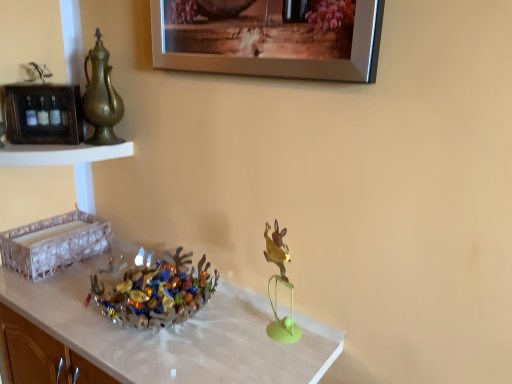
Question: Considering the positions of point (80, 178) and point (233, 38), is point (80, 178) closer or farther from the camera than point (233, 38)?

Choices:
 (A) closer
 (B) farther

Answer: (B)

Question: In terms of size, does white textured tray at upper left appear bigger or smaller than silver metallic picture frame at upper center?

Choices:
 (A) big
 (B) small

Answer: (B)

Question: Estimate the real-world distances between objects in this image. Which object is farther from the silver metallic picture frame at upper center?

Choices:
 (A) translucent glass bowl at center
 (B) metallic gold rabbit at center
 (C) gold metallic teapot at left
 (D) white textured tray at upper left
 (E) wooden frame at left, the 2th shelf from the bottom

Answer: (A)

Question: Based on their relative distances, which object is farther from the gold metallic teapot at left?

Choices:
 (A) wooden frame at left, the 2th shelf from the bottom
 (B) white textured tray at upper left
 (C) translucent glass bowl at center
 (D) translucent glass bowl at center
 (E) silver metallic picture frame at upper center

Answer: (C)